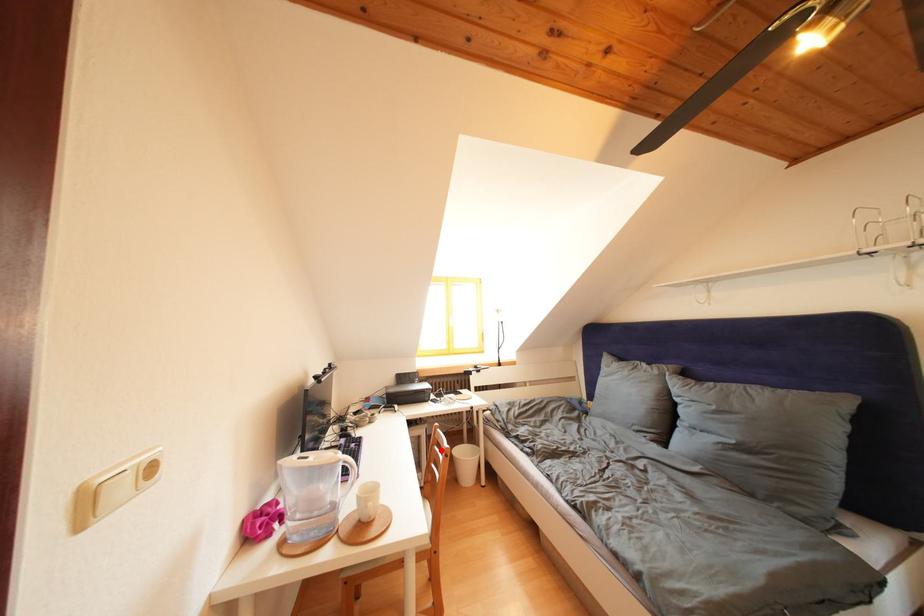
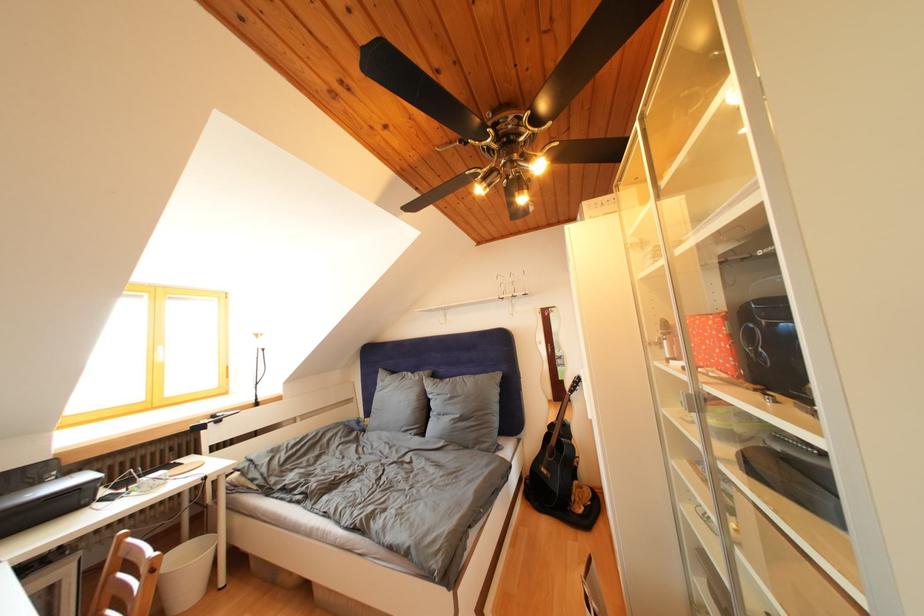
Question: A red point is marked in image1. In image2, is the corresponding 3D point closer to the camera or farther? Reply with the corresponding letter.

Choices:
 (A) The corresponding 3D point is closer.
 (B) The corresponding 3D point is farther.

Answer: (B)